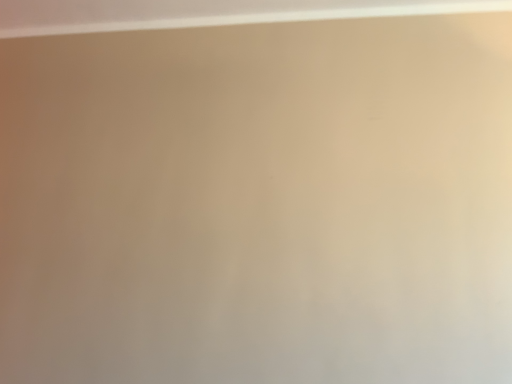
Where is `white smooth window sill at upper center`? white smooth window sill at upper center is located at coordinates [x=205, y=13].

The image size is (512, 384). What do you see at coordinates (205, 13) in the screenshot? I see `white smooth window sill at upper center` at bounding box center [205, 13].

Measure the distance between white smooth window sill at upper center and camera.

white smooth window sill at upper center and camera are 4.62 feet apart from each other.

Locate an element on the screen. Image resolution: width=512 pixels, height=384 pixels. white smooth window sill at upper center is located at coordinates (205, 13).